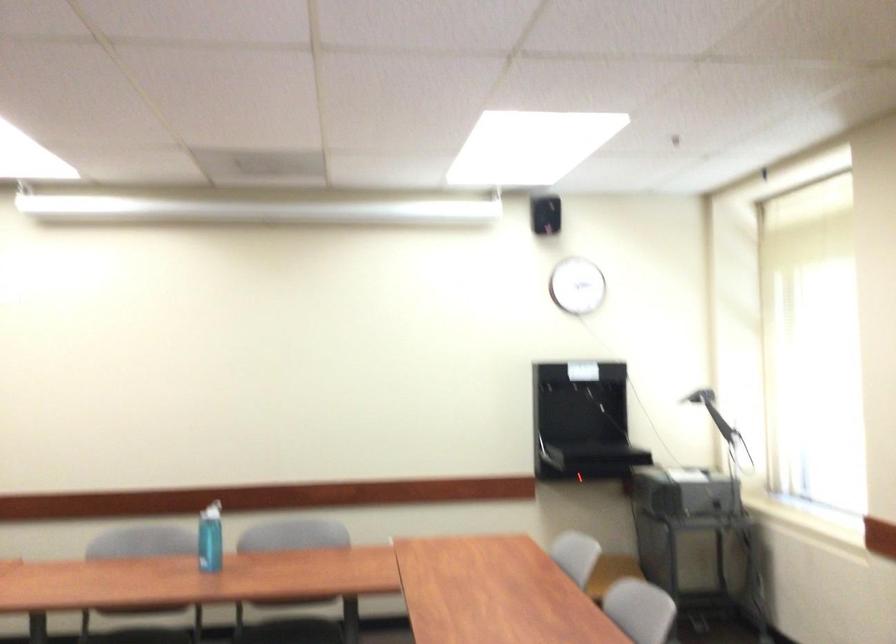
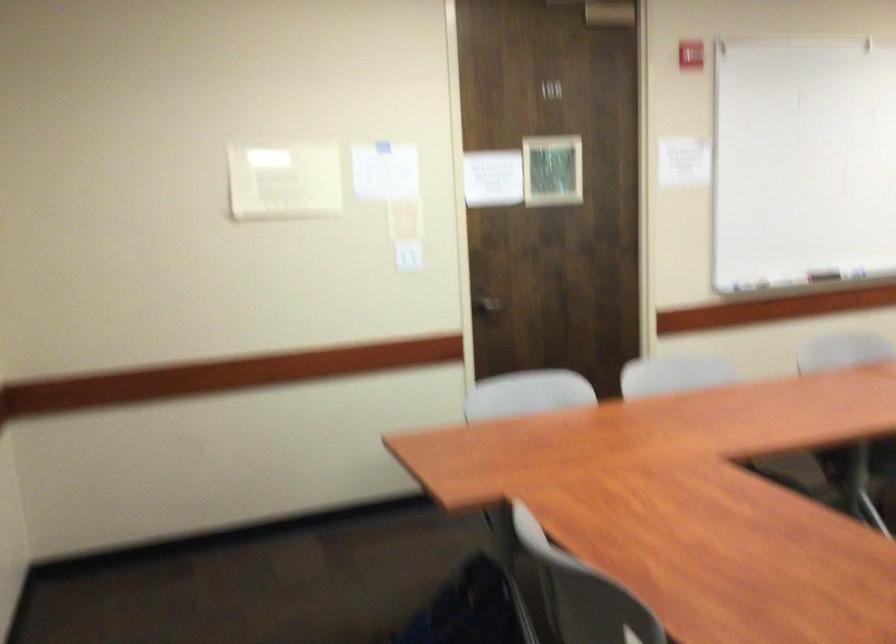
Question: The first image is from the beginning of the video and the second image is from the end. How did the camera likely rotate when shooting the video?

Choices:
 (A) Left
 (B) Right
 (C) Up
 (D) Down

Answer: (A)